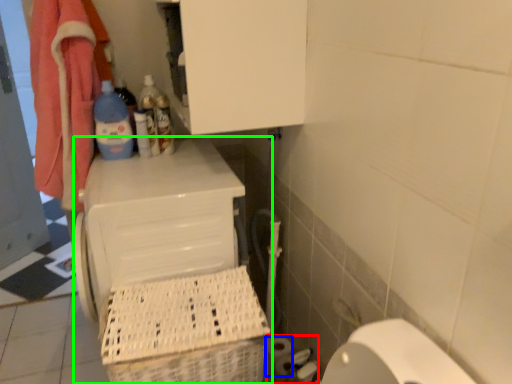
Question: Estimate the real-world distances between objects in this image. Which object is farther from toilet paper (highlighted by a red box), toilet paper (highlighted by a blue box) or appliance (highlighted by a green box)?

Choices:
 (A) toilet paper
 (B) appliance

Answer: (B)